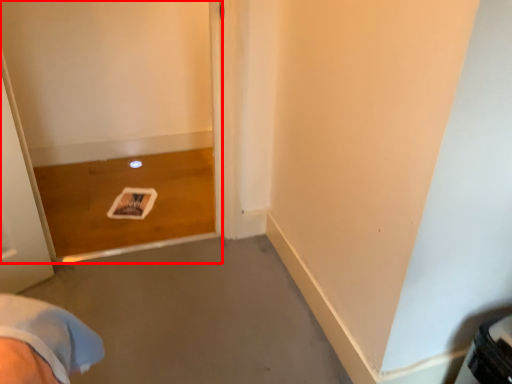
Question: From the image, what is the correct spatial relationship of screen door (annotated by the red box) in relation to concrete?

Choices:
 (A) right
 (B) left

Answer: (B)